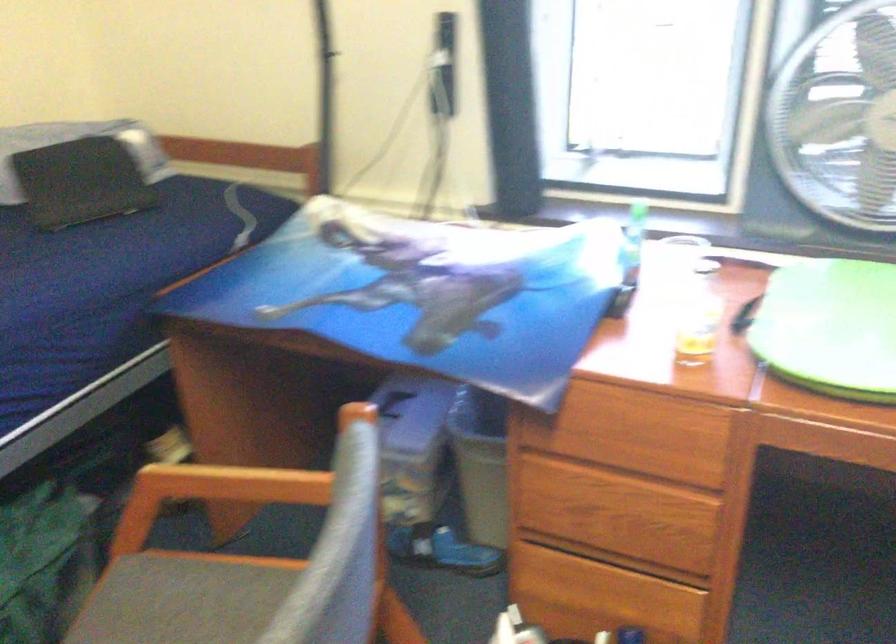
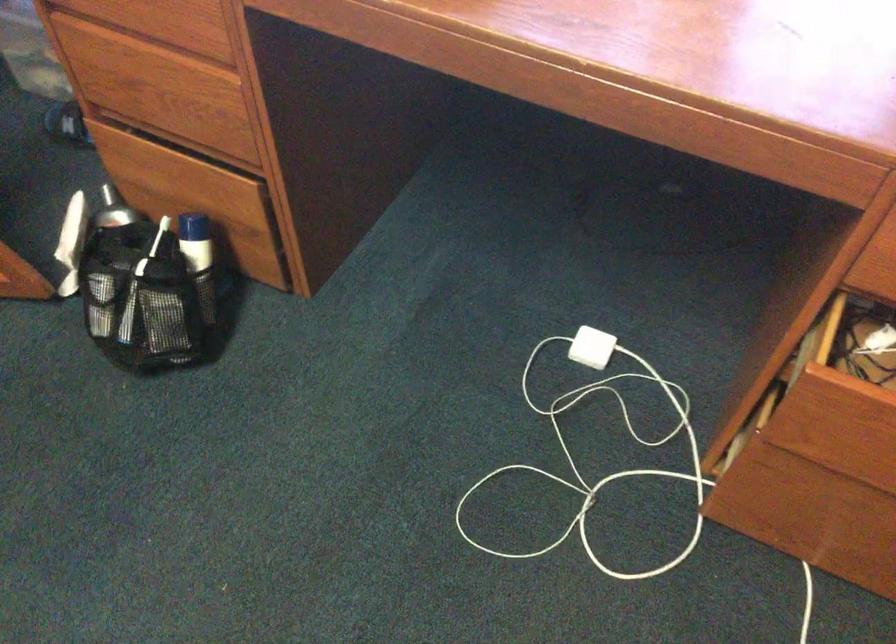
Question: What movement of the cameraman would produce the second image?

Choices:
 (A) Left
 (B) Right
 (C) Forward
 (D) Backward

Answer: (B)